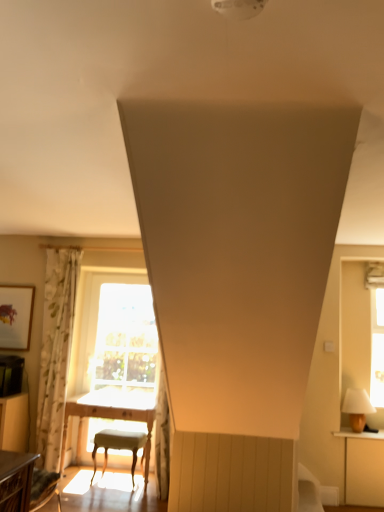
Question: Should I look upward or downward to see matte white lampshade at right?

Choices:
 (A) up
 (B) down

Answer: (B)

Question: Should I look upward or downward to see light wood table at center, arranged as the 1th table when ordered from the bottom?

Choices:
 (A) down
 (B) up

Answer: (A)

Question: Considering the relative sizes of light wood table at center, the 2th table from the front, and floral fabric curtain at left in the image provided, is light wood table at center, the 2th table from the front, taller than floral fabric curtain at left?

Choices:
 (A) no
 (B) yes

Answer: (A)

Question: From the image's perspective, is light wood table at center, the 2th table from the front, over floral fabric curtain at left?

Choices:
 (A) yes
 (B) no

Answer: (B)

Question: From a real-world perspective, does light wood table at center, arranged as the 1th table when ordered from the bottom, stand above floral fabric curtain at left?

Choices:
 (A) no
 (B) yes

Answer: (A)

Question: Considering the relative positions of light wood table at center, the first table in the back-to-front sequence, and floral fabric curtain at left in the image provided, is light wood table at center, the first table in the back-to-front sequence, to the left of floral fabric curtain at left from the viewer's perspective?

Choices:
 (A) yes
 (B) no

Answer: (B)

Question: Is floral fabric curtain at left inside light wood table at center, the 2th table from the front?

Choices:
 (A) yes
 (B) no

Answer: (B)

Question: Is light wood table at center, the 2th table from the front, bigger than floral fabric curtain at left?

Choices:
 (A) no
 (B) yes

Answer: (B)

Question: Does wooden table at lower left, which is the second table from bottom to top, have a lesser height compared to light gray fabric stool at center?

Choices:
 (A) yes
 (B) no

Answer: (A)

Question: Does wooden table at lower left, which is the second table from bottom to top, have a smaller size compared to light gray fabric stool at center?

Choices:
 (A) yes
 (B) no

Answer: (A)

Question: Is wooden table at lower left, which is the 1th table from top to bottom, touching light gray fabric stool at center?

Choices:
 (A) no
 (B) yes

Answer: (A)

Question: Is wooden table at lower left, which is the second table from bottom to top, located outside light gray fabric stool at center?

Choices:
 (A) yes
 (B) no

Answer: (A)

Question: From a real-world perspective, is wooden table at lower left, acting as the first table starting from the front, physically below light gray fabric stool at center?

Choices:
 (A) yes
 (B) no

Answer: (B)

Question: Can you confirm if wooden table at lower left, acting as the first table starting from the front, is wider than light gray fabric stool at center?

Choices:
 (A) no
 (B) yes

Answer: (A)

Question: Is light gray fabric stool at center not close to matte wooden picture frame at upper left?

Choices:
 (A) yes
 (B) no

Answer: (A)